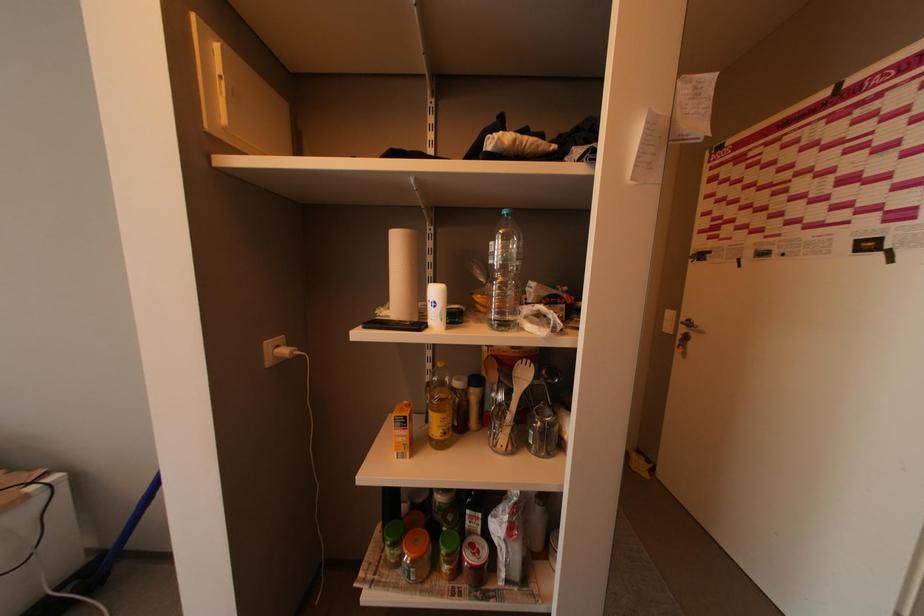
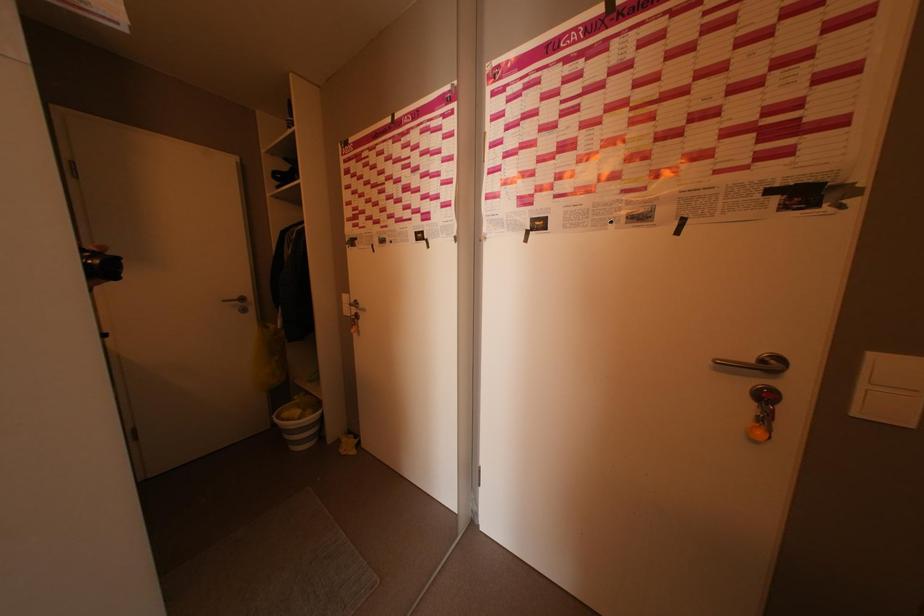
Question: The camera is either moving clockwise (left) or counter-clockwise (right) around the object. The first image is from the beginning of the video and the second image is from the end. Is the camera moving left or right when shooting the video?

Choices:
 (A) Left
 (B) Right

Answer: (A)